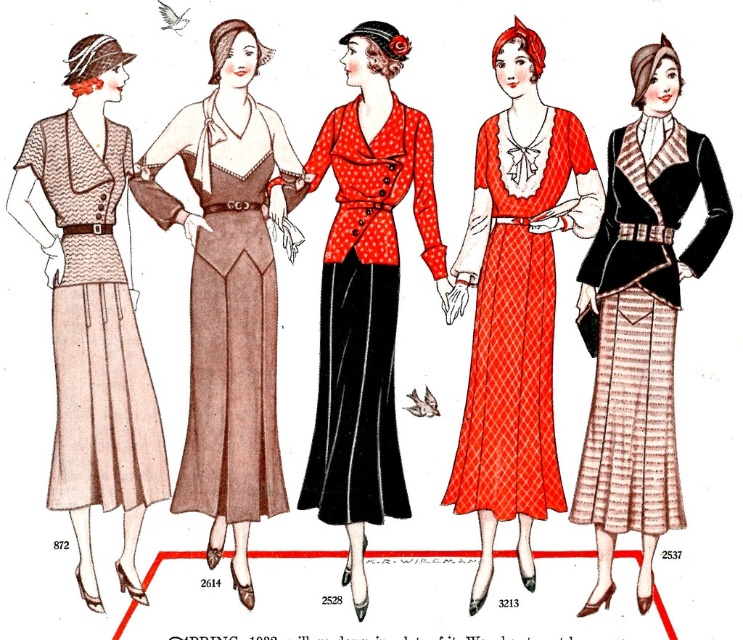
Question: Where is matte red dress at center located in relation to matte black vest at center in the image?

Choices:
 (A) above
 (B) below

Answer: (A)

Question: Among these points, which one is farthest from the camera?

Choices:
 (A) (97, 596)
 (B) (600, 534)
 (C) (272, 256)

Answer: (B)

Question: Does matte red dress at center appear under matte beige dress at left?

Choices:
 (A) no
 (B) yes

Answer: (A)

Question: Is the position of matte red dress at center more distant than that of matte black vest at center?

Choices:
 (A) no
 (B) yes

Answer: (B)

Question: Which object appears farthest from the camera in this image?

Choices:
 (A) matte brown dress at center
 (B) matte red dress at center
 (C) matte beige dress at left
 (D) matte black vest at center

Answer: (B)

Question: Among these objects, which one is nearest to the camera?

Choices:
 (A) matte brown dress at center
 (B) matte beige dress at left
 (C) matte black vest at center

Answer: (B)